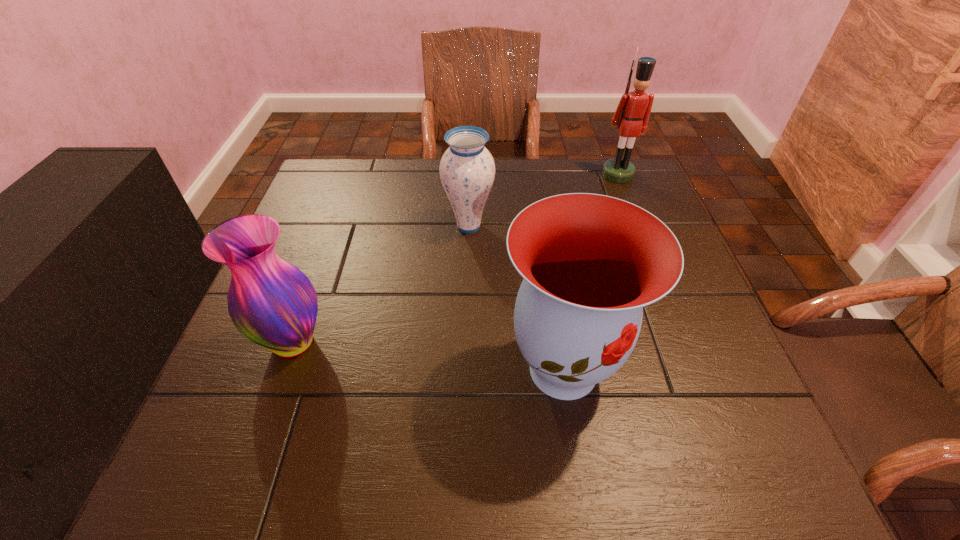
Find the location of `object situated at the far edge`. object situated at the far edge is located at coordinates (632, 114).

Where is `object positioned at the left edge`? object positioned at the left edge is located at coordinates (271, 302).

This screenshot has width=960, height=540. I want to click on object situated at the right edge, so click(x=632, y=114).

Where is `object located at the far right corner`? Image resolution: width=960 pixels, height=540 pixels. object located at the far right corner is located at coordinates (632, 114).

I want to click on vacant space at the far edge of the desktop, so click(x=441, y=187).

You are a GUI agent. You are given a task and a screenshot of the screen. Output one action in this format:
    pyautogui.click(x=<x>, y=<y>)
    Task: Click on the vacant region at the near edge of the desktop
    The height and width of the screenshot is (540, 960).
    Given the screenshot: What is the action you would take?
    pyautogui.click(x=338, y=457)

The width and height of the screenshot is (960, 540). I want to click on vacant area at the left edge, so click(329, 262).

I want to click on blank area at the right edge, so click(655, 381).

Locate an element on the screen. free region at the far left corner of the desktop is located at coordinates (364, 179).

The width and height of the screenshot is (960, 540). In order to click on blank space at the near left corner in this screenshot , I will do `click(185, 464)`.